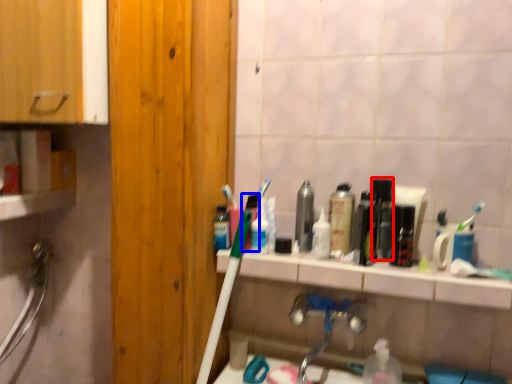
Question: Which of the following is the closest to the observer, mouthwash (highlighted by a red box) or mouthwash (highlighted by a blue box)?

Choices:
 (A) mouthwash
 (B) mouthwash

Answer: (A)